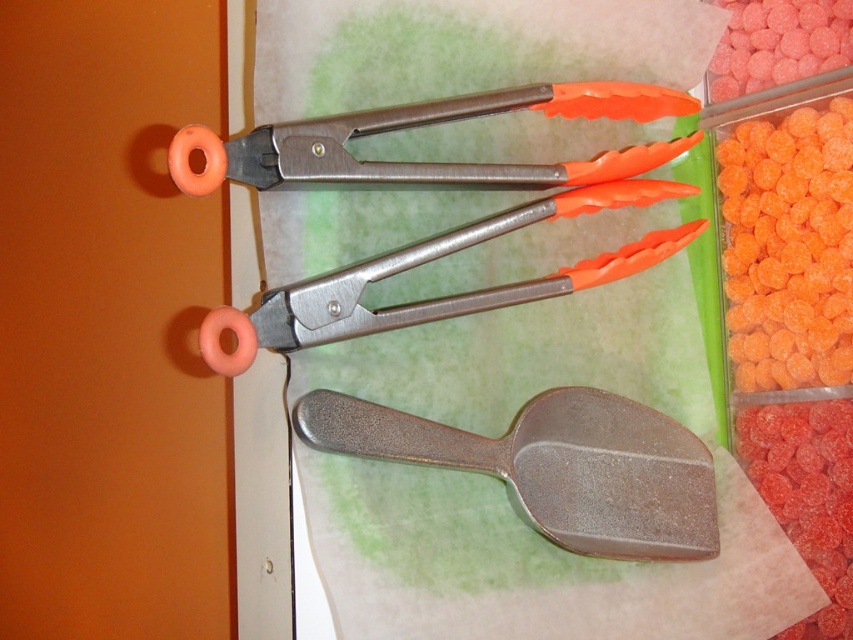
You are a chef preparing to organize your kitchen tools. You have a drawer that is 10 inches wide. Can both the metallic gray spatula at center and the orange rubber tongs at upper center fit side by side in the drawer without overlapping?

The metallic gray spatula at center and orange rubber tongs at upper center are 10.18 inches apart from each other. Since the drawer is only 10 inches wide, they cannot fit side by side without overlapping.

You are organizing kitchen utensils and need to place the metallic gray spatula at center and the orange rubber tongs at upper center into a drawer. Which utensil should you place first to ensure proper stacking?

You should place the orange rubber tongs at upper center first because the metallic gray spatula at center is closer to the viewer, meaning it is in front of the tongs. To stack properly, place the utensil at the back first before placing the one in front.